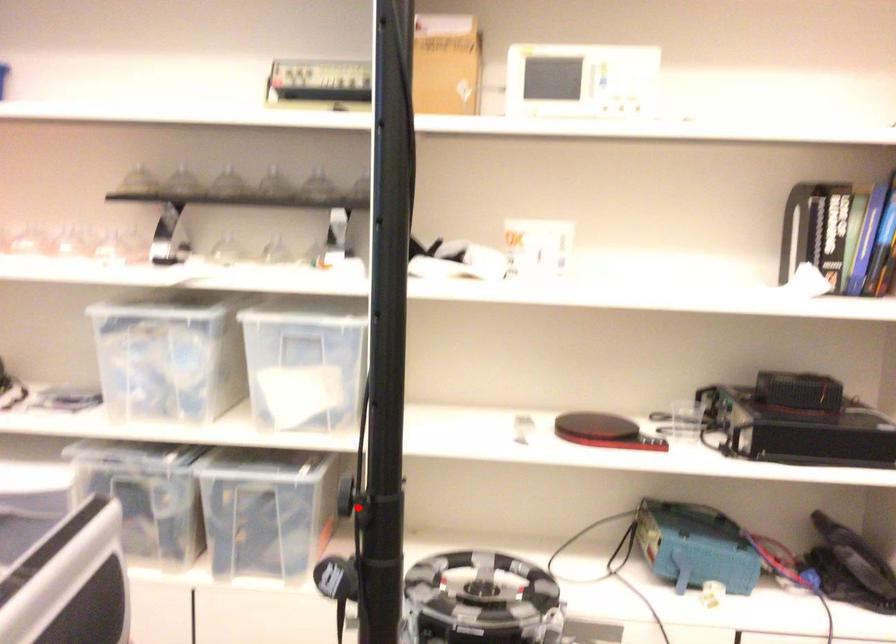
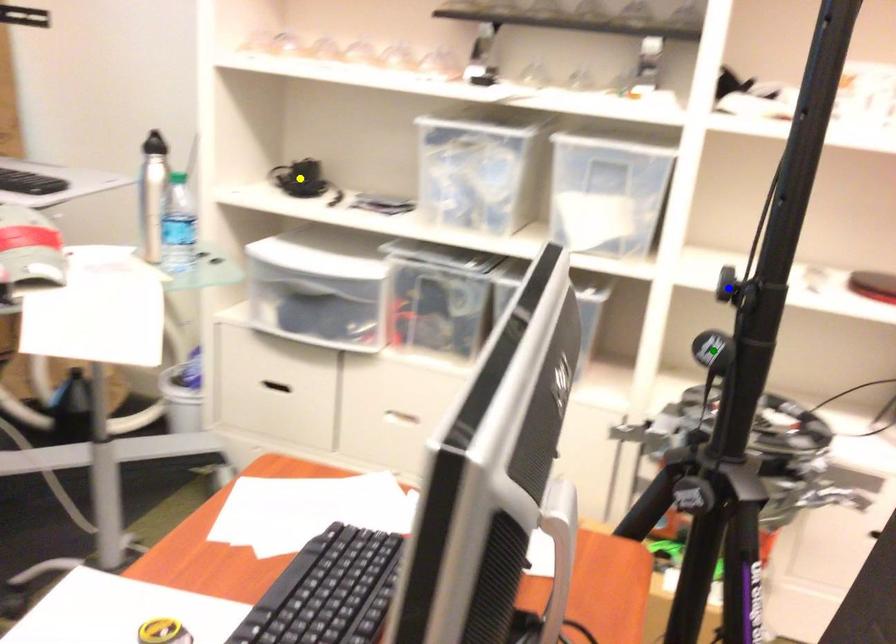
Question: I am providing you with two images of the same scene from different viewpoints. A red point is marked on the first image. You are given multiple points on the second image. In image 2, which mark is for the same physical point as the one in image 1?

Choices:
 (A) blue point
 (B) yellow point
 (C) green point

Answer: (A)